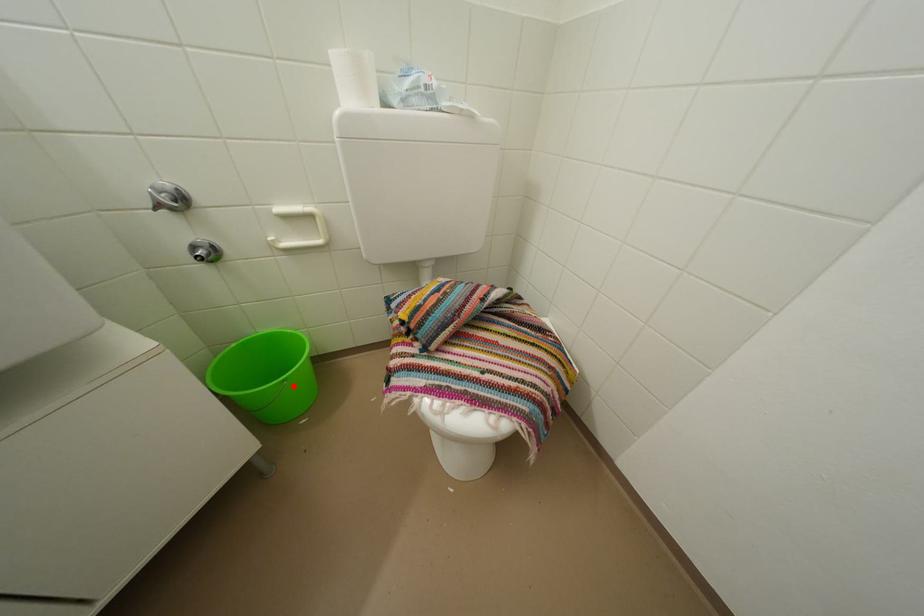
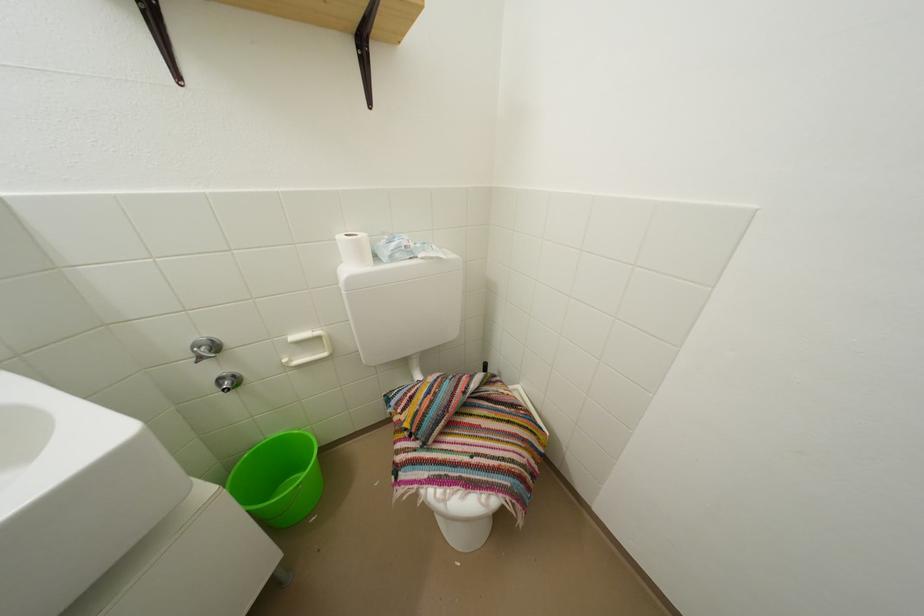
Question: I am providing you with two images of the same scene from different viewpoints. A red point is marked on the first image. At the location where the point appears in image 1, is it still visible in image 2?

Choices:
 (A) Yes
 (B) No

Answer: (A)